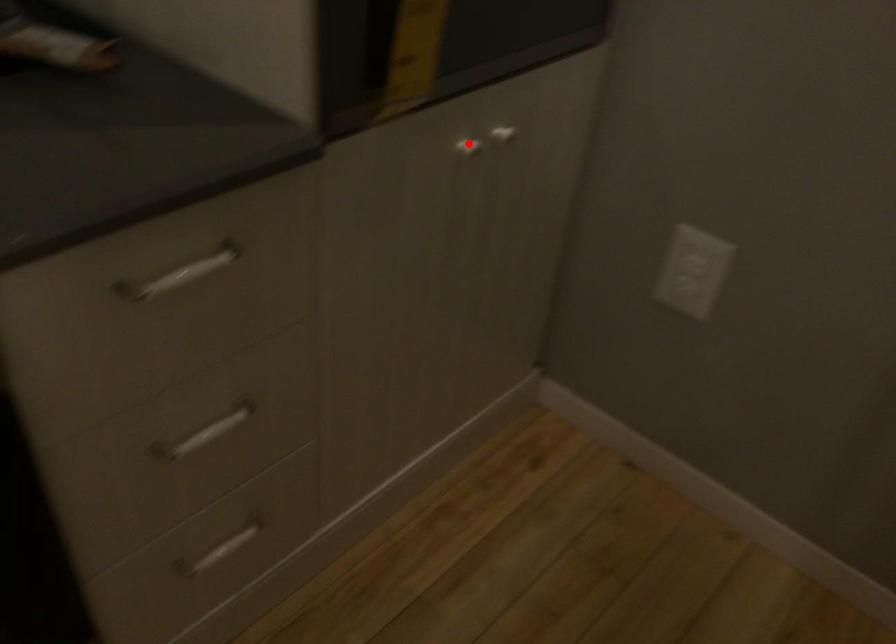
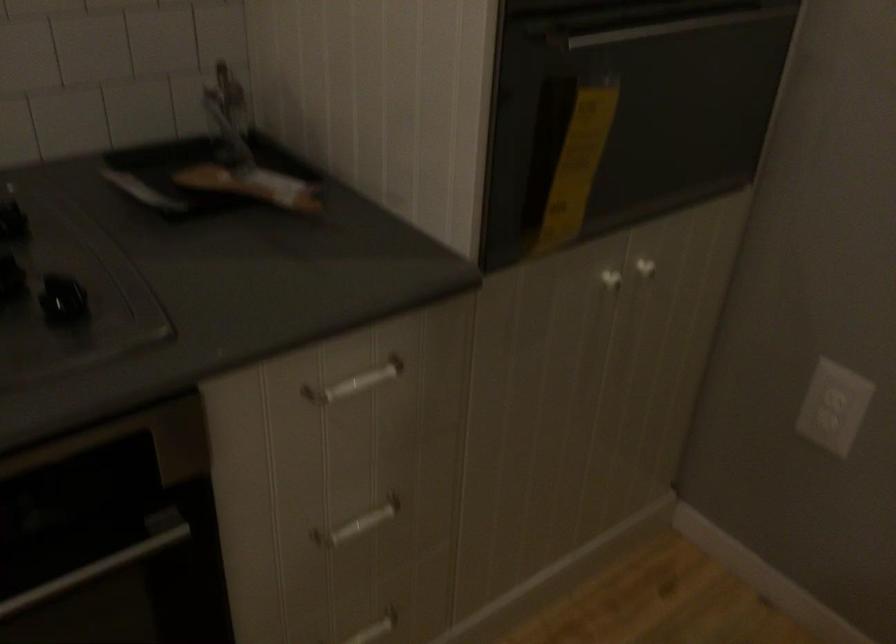
In the second image, find the point that corresponds to the highlighted location in the first image.

(609, 278)